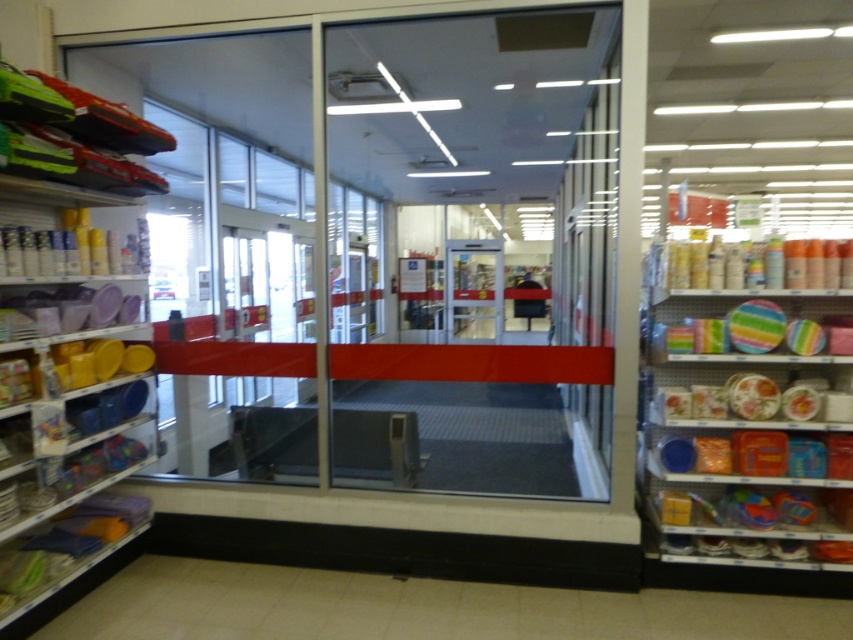
This screenshot has height=640, width=853. What do you see at coordinates (68, 374) in the screenshot? I see `matte plastic containers at left` at bounding box center [68, 374].

In the scene shown: Is matte plastic containers at left shorter than clear glass door at center?

No.

Who is more distant from viewer, (x=70, y=184) or (x=468, y=269)?

The point (x=468, y=269) is behind.

Where is `matte plastic containers at left`? matte plastic containers at left is located at coordinates (68, 374).

Does white tile floor at lower center have a lesser width compared to matte plastic containers at right?

No, white tile floor at lower center is not thinner than matte plastic containers at right.

Can you confirm if white tile floor at lower center is positioned to the right of matte plastic containers at right?

In fact, white tile floor at lower center is to the left of matte plastic containers at right.

Who is more forward, (163, 582) or (764, 250)?

Point (764, 250)

The image size is (853, 640). What are the coordinates of `white tile floor at lower center` in the screenshot? It's located at (422, 605).

Can you confirm if matte plastic containers at left is positioned below matte plastic containers at right?

Yes, matte plastic containers at left is below matte plastic containers at right.

Does matte plastic containers at left appear on the left side of matte plastic containers at right?

Indeed, matte plastic containers at left is positioned on the left side of matte plastic containers at right.

Describe the element at coordinates (68, 374) in the screenshot. Image resolution: width=853 pixels, height=640 pixels. I see `matte plastic containers at left` at that location.

Identify the location of matte plastic containers at left. The image size is (853, 640). (68, 374).